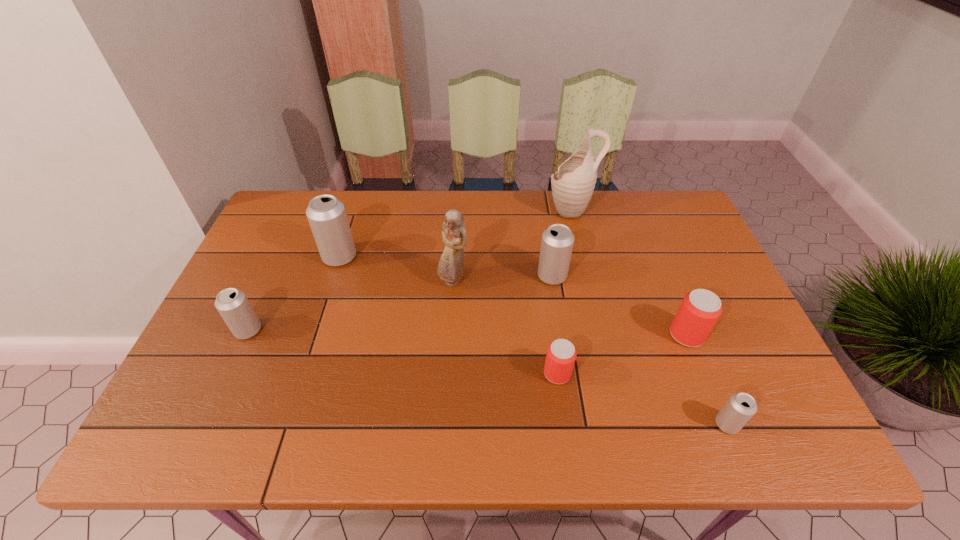
Identify the location of vacant space in between the right red beer can and the smaller red beer can. (622, 354).

Choose which object is the fifth nearest neighbor to the biggest white beer can. Please provide its 2D coordinates. Your answer should be formatted as a tuple, i.e. [(x, y)], where the tuple contains the x and y coordinates of a point satisfying the conditions above.

[(561, 354)]

Locate which object ranks second in proximity to the farther red beer can. Please provide its 2D coordinates. Your answer should be formatted as a tuple, i.e. [(x, y)], where the tuple contains the x and y coordinates of a point satisfying the conditions above.

[(557, 242)]

At what (x,y) coordinates should I click in order to perform the action: click on the fourth closest beer can to the seventh farthest object. Please return your answer as a coordinate pair (x, y). Image resolution: width=960 pixels, height=540 pixels. Looking at the image, I should click on (327, 217).

Where is `beer can that stands as the fourth closest to the bigger red beer can`? This screenshot has width=960, height=540. beer can that stands as the fourth closest to the bigger red beer can is located at coordinates (327, 217).

Locate an element on the screen. The width and height of the screenshot is (960, 540). the third closest white beer can relative to the smallest white beer can is located at coordinates (232, 304).

Point out which white beer can is positioned as the fourth nearest to the farther red beer can. Please provide its 2D coordinates. Your answer should be formatted as a tuple, i.e. [(x, y)], where the tuple contains the x and y coordinates of a point satisfying the conditions above.

[(232, 304)]

Find the location of a particular element. The width and height of the screenshot is (960, 540). free region that satisfies the following two spatial constraints: 1. at the spout of the pitcher; 2. on the back side of the nearest object is located at coordinates (621, 424).

The width and height of the screenshot is (960, 540). I want to click on blank area in the image that satisfies the following two spatial constraints: 1. on the front-facing side of the farther red beer can; 2. on the left side of the third object from left to right, so click(450, 335).

Identify the location of vacant region that satisfies the following two spatial constraints: 1. at the spout of the tallest object; 2. on the front side of the leftmost beer can. (599, 330).